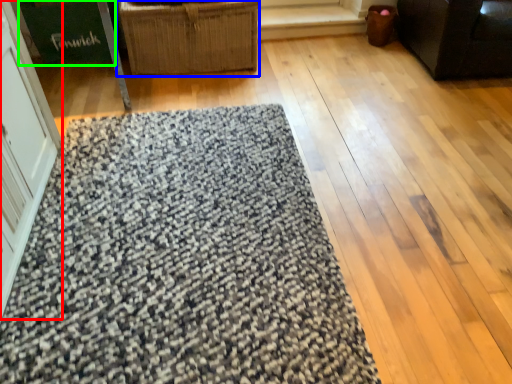
Question: Based on their relative distances, which object is farther from screen door (highlighted by a red box)? Choose from furniture (highlighted by a blue box) and cardboard box (highlighted by a green box).

Choices:
 (A) furniture
 (B) cardboard box

Answer: (B)